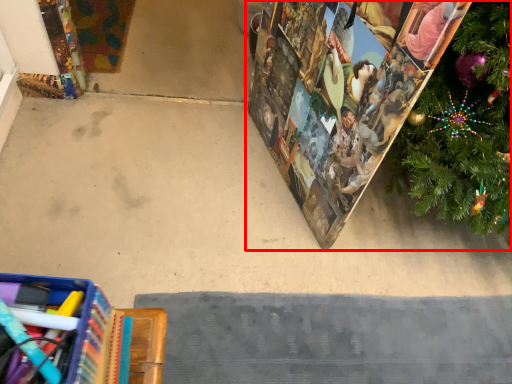
Question: From the image, what is the correct spatial relationship of christmas decoration (annotated by the red box) in relation to concrete?

Choices:
 (A) left
 (B) right

Answer: (B)